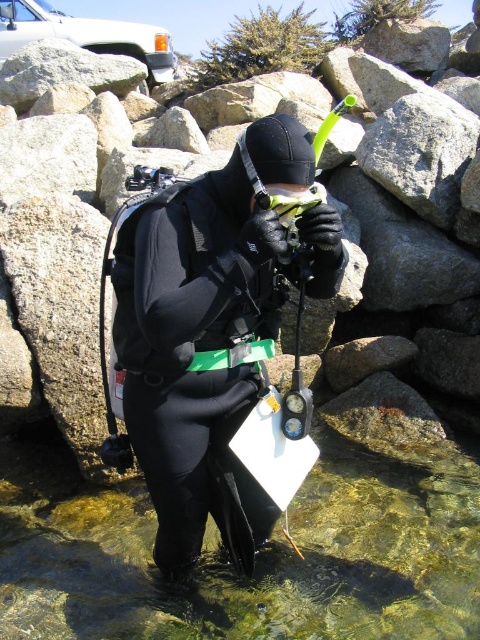
Question: Among these objects, which one is nearest to the camera?

Choices:
 (A) clear water at lower center
 (B) black matte scuba tank at center
 (C) black matte wetsuit at center

Answer: (C)

Question: Is clear water at lower center bigger than black matte scuba tank at center?

Choices:
 (A) no
 (B) yes

Answer: (B)

Question: Is black matte wetsuit at center bigger than black matte scuba tank at center?

Choices:
 (A) yes
 (B) no

Answer: (B)

Question: Based on their relative distances, which object is nearer to the clear water at lower center?

Choices:
 (A) black matte scuba tank at center
 (B) matte black goggles at center
 (C) black matte wetsuit at center

Answer: (C)

Question: Which object appears farthest from the camera in this image?

Choices:
 (A) clear water at lower center
 (B) matte black goggles at center

Answer: (A)

Question: Can you confirm if black matte scuba tank at center is positioned to the left of matte black goggles at center?

Choices:
 (A) no
 (B) yes

Answer: (B)